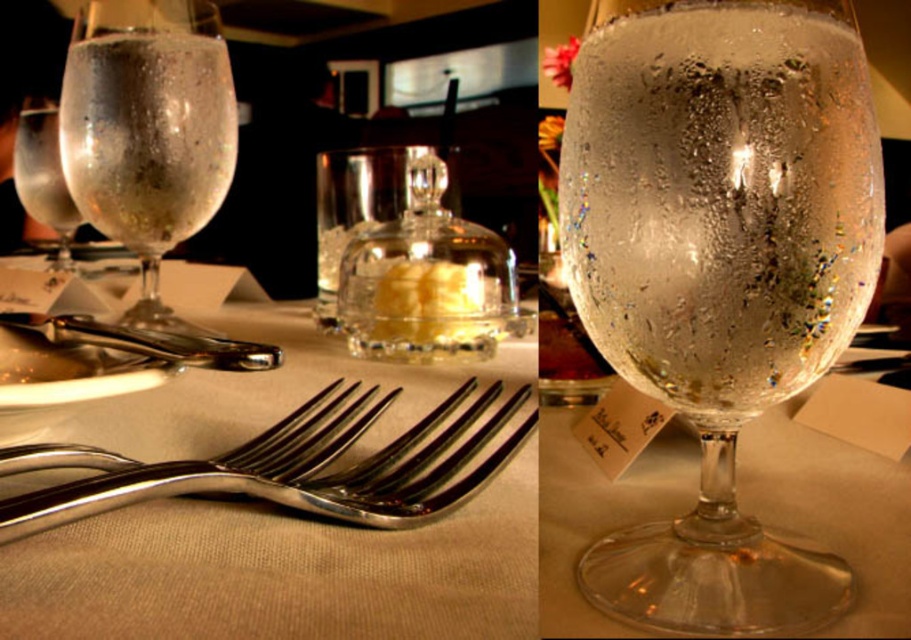
Who is more distant from viewer, (x=192, y=102) or (x=397, y=484)?

Point (x=192, y=102)

From the picture: Measure the distance between point (101, 202) and camera.

Point (101, 202) and camera are 19.64 inches apart.

Which is in front, point (223, 122) or point (374, 476)?

Point (374, 476) is in front.

You are a GUI agent. You are given a task and a screenshot of the screen. Output one action in this format:
    pyautogui.click(x=<x>, y=<y>)
    Task: Click on the translucent glass wine glass at center
    
    Given the screenshot: What is the action you would take?
    pos(148,131)

Does translucent glass wine glass at center appear on the right side of polished metal knife at lower left?

In fact, translucent glass wine glass at center is to the left of polished metal knife at lower left.

Is translucent glass wine glass at center taller than polished metal knife at lower left?

Indeed, translucent glass wine glass at center has a greater height compared to polished metal knife at lower left.

The width and height of the screenshot is (911, 640). What do you see at coordinates (148, 131) in the screenshot?
I see `translucent glass wine glass at center` at bounding box center [148, 131].

Locate an element on the screen. Image resolution: width=911 pixels, height=640 pixels. translucent glass wine glass at center is located at coordinates (148, 131).

Does polished metal knife at lower left have a greater height compared to clear textured glass at upper left?

In fact, polished metal knife at lower left may be shorter than clear textured glass at upper left.

Between point (251, 368) and point (60, 241), which one is positioned behind?

Positioned behind is point (60, 241).

You are a GUI agent. You are given a task and a screenshot of the screen. Output one action in this format:
    pyautogui.click(x=<x>, y=<y>)
    Task: Click on the polished metal knife at lower left
    
    Given the screenshot: What is the action you would take?
    pyautogui.click(x=147, y=340)

I want to click on polished metal knife at lower left, so click(x=147, y=340).